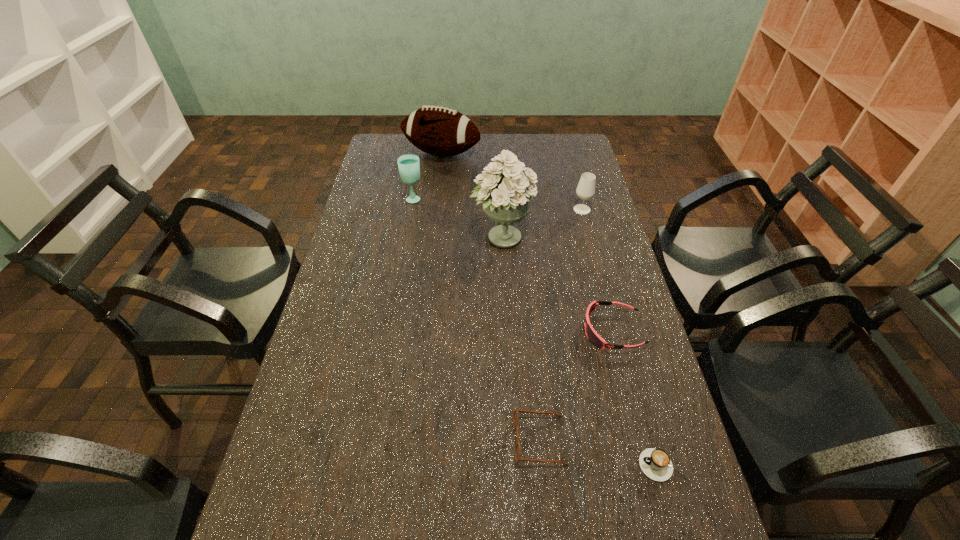
Identify the location of free space located on the front-facing side of the spectacles. This screenshot has height=540, width=960. pyautogui.click(x=367, y=440).

Locate an element on the screen. The image size is (960, 540). vacant area located 0.290m on the front-facing side of the spectacles is located at coordinates (388, 440).

Locate an element on the screen. The width and height of the screenshot is (960, 540). free space located with the handle on the side of the cappuccino is located at coordinates (492, 465).

At what (x,y) coordinates should I click in order to perform the action: click on free space located 0.230m with the handle on the side of the cappuccino. Please return your answer as a coordinate pair (x, y). Looking at the image, I should click on (536, 465).

Find the location of `vacant space located 0.270m with the handle on the side of the cappuccino`. vacant space located 0.270m with the handle on the side of the cappuccino is located at coordinates (518, 465).

You are a GUI agent. You are given a task and a screenshot of the screen. Output one action in this format:
    pyautogui.click(x=<x>, y=<y>)
    Task: Click on the object that is at the far edge
    
    Given the screenshot: What is the action you would take?
    pyautogui.click(x=440, y=131)

Locate an element on the screen. object situated at the left edge is located at coordinates [440, 131].

Where is `glass situated at the right edge`? The height and width of the screenshot is (540, 960). glass situated at the right edge is located at coordinates pos(585,190).

Find the location of a particular element. The width and height of the screenshot is (960, 540). goggles present at the right edge is located at coordinates (592, 335).

Where is `cappuccino that is at the right edge`? The image size is (960, 540). cappuccino that is at the right edge is located at coordinates (655, 463).